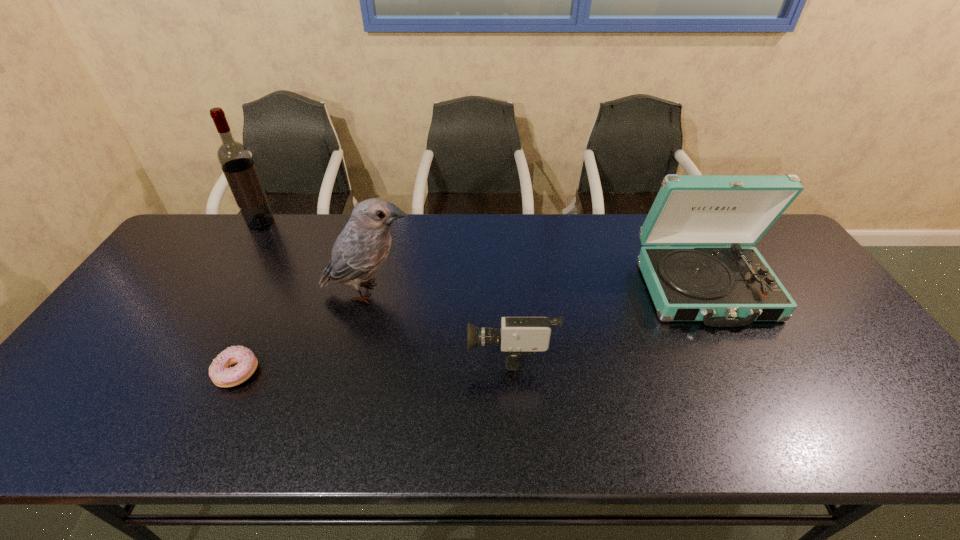
Where is `vacant space at the near edge of the desktop`? The width and height of the screenshot is (960, 540). vacant space at the near edge of the desktop is located at coordinates (396, 423).

This screenshot has width=960, height=540. What are the coordinates of `vacant area at the right edge` in the screenshot? It's located at (798, 279).

Locate an element on the screen. This screenshot has height=540, width=960. vacant space at the far left corner of the desktop is located at coordinates (229, 227).

Find the location of a particular element. The width and height of the screenshot is (960, 540). vacant space that is in between the rightmost object and the third object from left to right is located at coordinates (537, 290).

Locate an element on the screen. This screenshot has width=960, height=540. free spot between the camcorder and the third object from left to right is located at coordinates click(440, 321).

The width and height of the screenshot is (960, 540). I want to click on vacant region between the second object from left to right and the tallest object, so click(250, 298).

Where is `empty space that is in between the doughnut and the parrot`? The image size is (960, 540). empty space that is in between the doughnut and the parrot is located at coordinates (303, 333).

Identify the location of vacant space in between the fourth object from right to left and the second object from right to left. The width and height of the screenshot is (960, 540). (374, 362).

At what (x,y) coordinates should I click in order to perform the action: click on empty location between the shortest object and the third object from left to right. Please return your answer as a coordinate pair (x, y). The width and height of the screenshot is (960, 540). Looking at the image, I should click on (303, 333).

What are the coordinates of `free space between the third object from right to left and the record player` in the screenshot? It's located at click(537, 290).